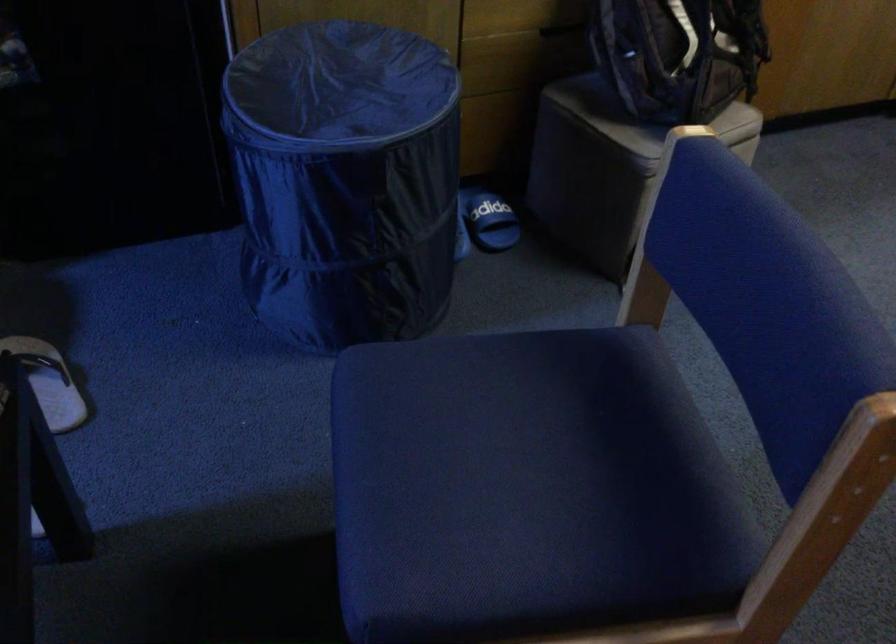
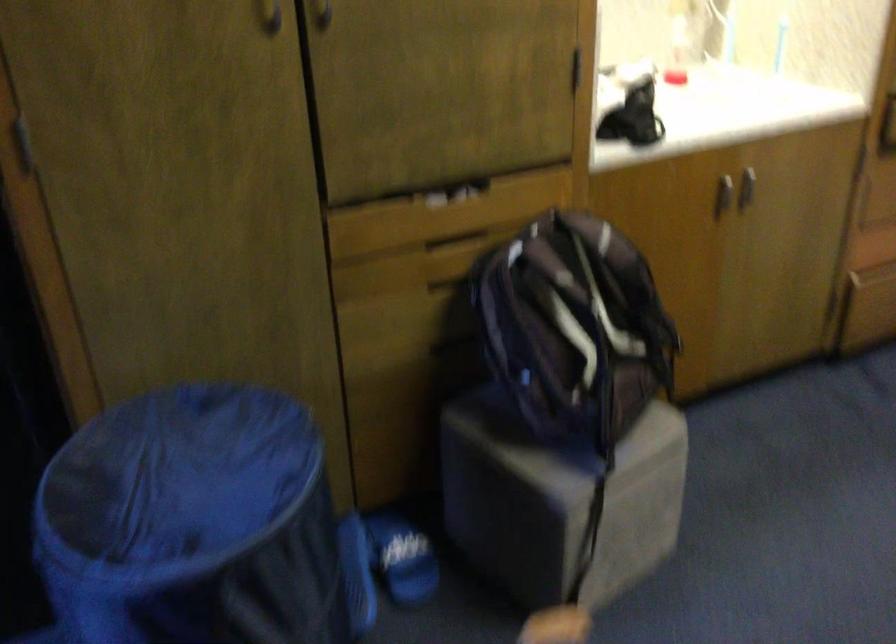
Locate, in the second image, the point that corresponds to [488,214] in the first image.

(401, 558)